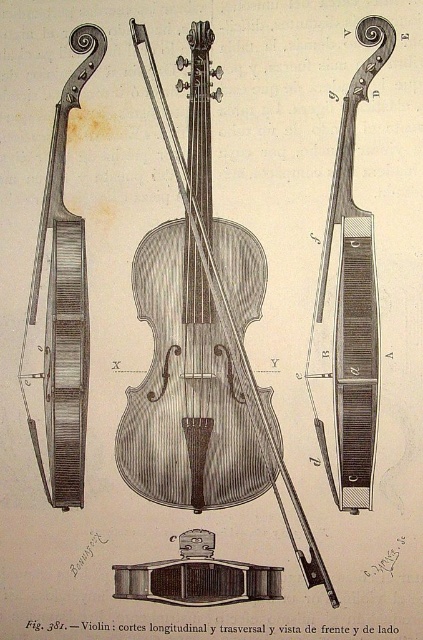
Consider the image. Is wooden violin at right taller than matte wood violin at left?

Yes.

What do you see at coordinates (351, 300) in the screenshot?
I see `wooden violin at right` at bounding box center [351, 300].

Who is more distant from viewer, (368, 237) or (84, 424)?

The point (84, 424) is more distant.

Locate an element on the screen. wooden violin at right is located at coordinates (351, 300).

Locate an element on the screen. Image resolution: width=423 pixels, height=640 pixels. wooden violin at center is located at coordinates (202, 339).

Does wooden violin at center appear under wooden violin at right?

Indeed, wooden violin at center is positioned under wooden violin at right.

Is point (230, 490) in front of point (332, 476)?

No, (230, 490) is further to viewer.

I want to click on wooden violin at center, so click(202, 339).

Can you confirm if wooden violin at center is bigger than matte wood violin at left?

Yes.

Is point (184, 420) positioned after point (21, 369)?

No, it is in front of (21, 369).

Describe the element at coordinates (202, 339) in the screenshot. This screenshot has width=423, height=640. I see `wooden violin at center` at that location.

This screenshot has height=640, width=423. I want to click on wooden violin at center, so click(202, 339).